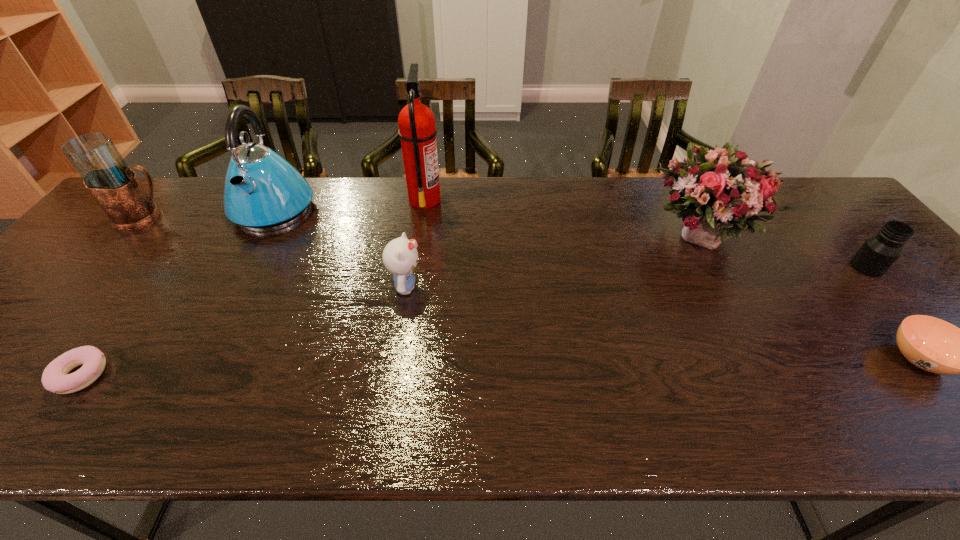
Find the location of a particular element. the tallest object is located at coordinates (417, 131).

Identify the location of kettle. The image size is (960, 540). (263, 192).

Where is `the sixth object from right to left`? The height and width of the screenshot is (540, 960). the sixth object from right to left is located at coordinates (263, 192).

Identify the location of the third object from right to left. This screenshot has height=540, width=960. (723, 192).

Where is `pitcher`? pitcher is located at coordinates (114, 185).

The height and width of the screenshot is (540, 960). In order to click on kitten in this screenshot , I will do pos(400,256).

Identify the location of jar. (878, 253).

Find the location of a particular element. doughnut is located at coordinates (55, 378).

Locate an element on the screen. Image resolution: width=960 pixels, height=540 pixels. the shortest object is located at coordinates (55, 378).

Image resolution: width=960 pixels, height=540 pixels. Identify the location of free space located 0.150m on the side of the fire extinguisher near the handle. (491, 199).